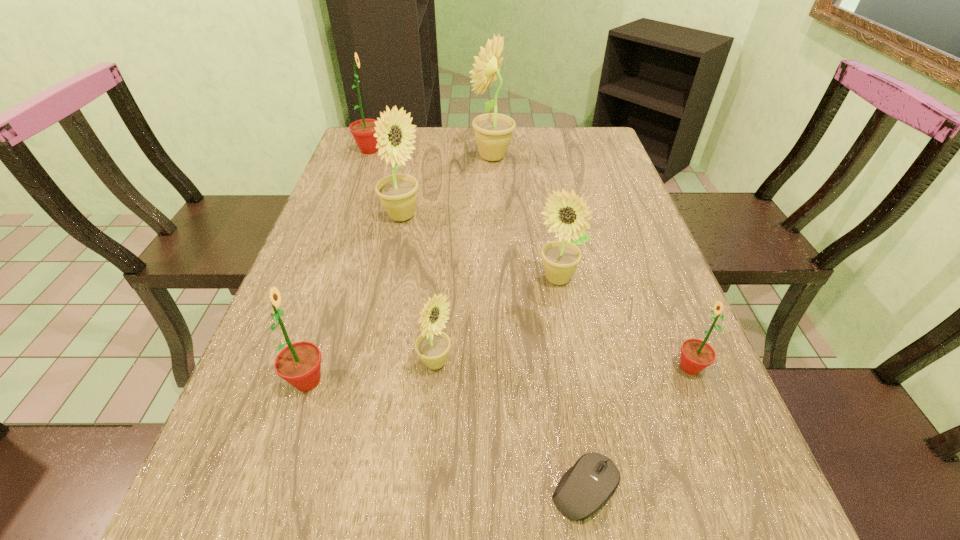
What are the coordinates of `vacant space located on the face of the third farthest yellow sunflower` in the screenshot? It's located at (582, 420).

Locate an element on the screen. The height and width of the screenshot is (540, 960). blank area located 0.350m on the face of the nearest yellow sunflower is located at coordinates (637, 363).

The width and height of the screenshot is (960, 540). In order to click on blank space located on the face of the smallest green sunflower in this screenshot , I will do `click(472, 368)`.

Image resolution: width=960 pixels, height=540 pixels. Find the location of `free spot located 0.310m on the face of the smallest green sunflower`. free spot located 0.310m on the face of the smallest green sunflower is located at coordinates (510, 368).

The width and height of the screenshot is (960, 540). In order to click on free region located on the face of the smallest green sunflower in this screenshot , I will do `click(467, 368)`.

Identify the location of vacant space located on the right of the shortest object. (712, 488).

Locate an element on the screen. Image resolution: width=960 pixels, height=540 pixels. object at the near edge is located at coordinates (584, 488).

Identify the location of object that is at the right edge. (x=696, y=355).

This screenshot has width=960, height=540. Identify the location of object at the far left corner. (363, 131).

You are a GUI agent. You are given a task and a screenshot of the screen. Output one action in this format:
    pyautogui.click(x=<x>, y=<y>)
    Task: Click on the free space at the far edge
    
    Given the screenshot: What is the action you would take?
    pyautogui.click(x=435, y=159)